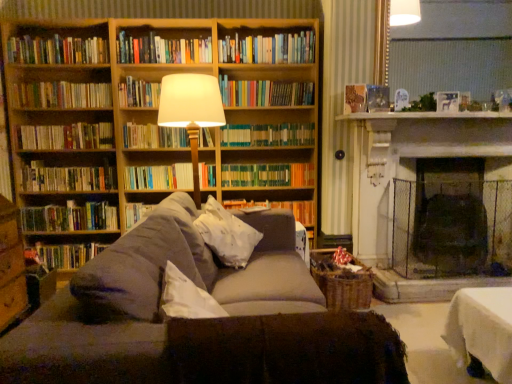
Question: Relative to wooden bookcase at upper left, is hardcover books at upper left, which ranks as the fifth book in top-to-bottom order, in front or behind?

Choices:
 (A) front
 (B) behind

Answer: (B)

Question: From a real-world perspective, is hardcover books at upper left, which ranks as the fifth book in top-to-bottom order, positioned above or below wooden bookcase at upper left?

Choices:
 (A) above
 (B) below

Answer: (A)

Question: Which of these objects is positioned closest to the matte white lampshade at center?

Choices:
 (A) white soft pillow at center
 (B) hardcover books at left, which appears as the tenth book when viewed from the top
 (C) green matte bookshelf at center, which appears as the 9th book when viewed from the top
 (D) hardcover book at left, arranged as the 1th book when ordered from the bottom
 (E) hardcover books at center, which is the 7th book in top-to-bottom order

Answer: (A)

Question: Which is nearer to the wooden bookcase at upper left?

Choices:
 (A) hardcover book at upper center
 (B) hardcover books at left, which appears as the 5th book when ordered from the bottom
 (C) hardcover books at center, which is the 8th book in bottom-to-top order
 (D) hardcover books at upper left, which ranks as the fifth book in top-to-bottom order
 (E) wooden bookshelf at upper center

Answer: (D)